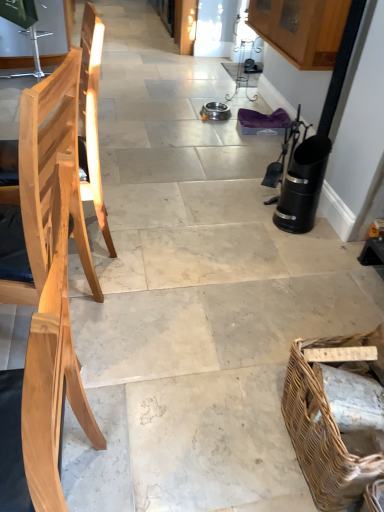
This screenshot has height=512, width=384. Identify the location of free space to the left of brown woven picnic basket at lower right. (232, 422).